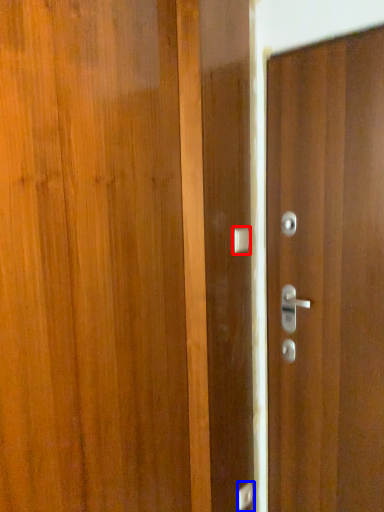
Question: Which object appears farthest to the camera in this image, door handle (highlighted by a red box) or door handle (highlighted by a blue box)?

Choices:
 (A) door handle
 (B) door handle

Answer: (B)